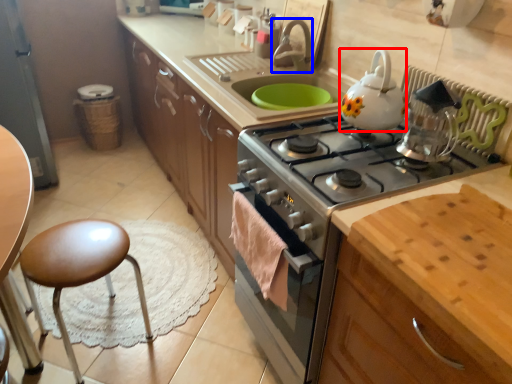
Question: Which of the following is the farthest to the observer, kitchen appliance (highlighted by a red box) or faucet (highlighted by a blue box)?

Choices:
 (A) kitchen appliance
 (B) faucet

Answer: (B)